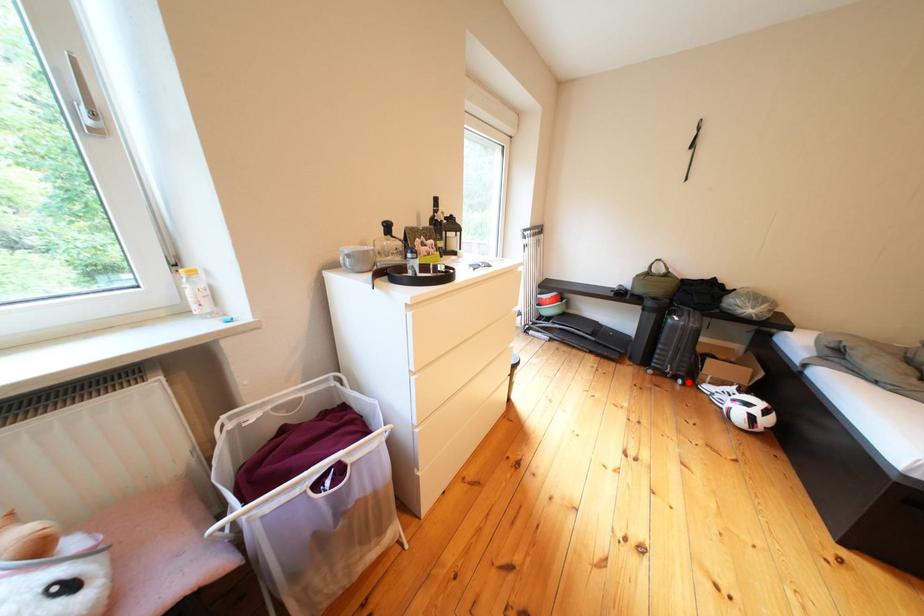
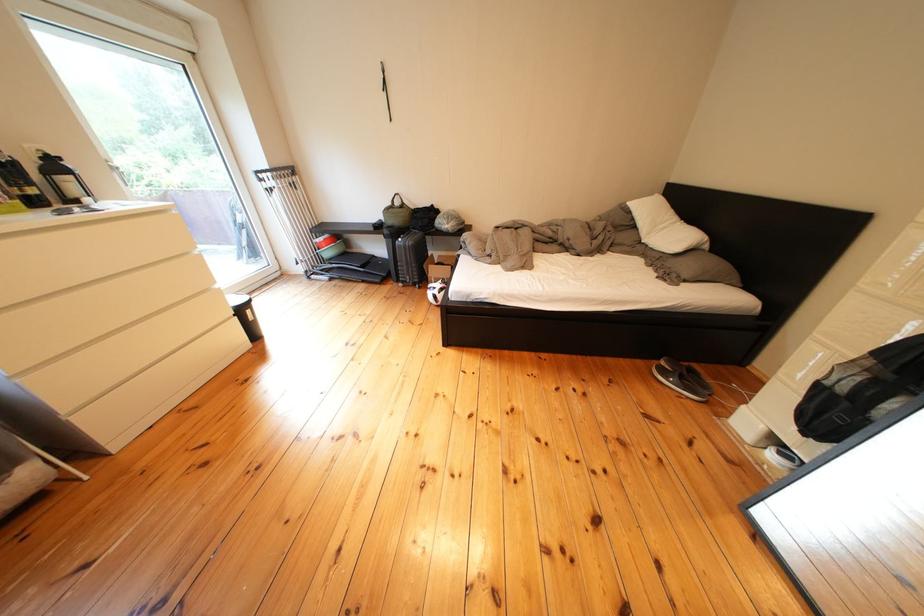
Where in the second image is the point corresponding to the highlighted location from the first image?

(429, 290)